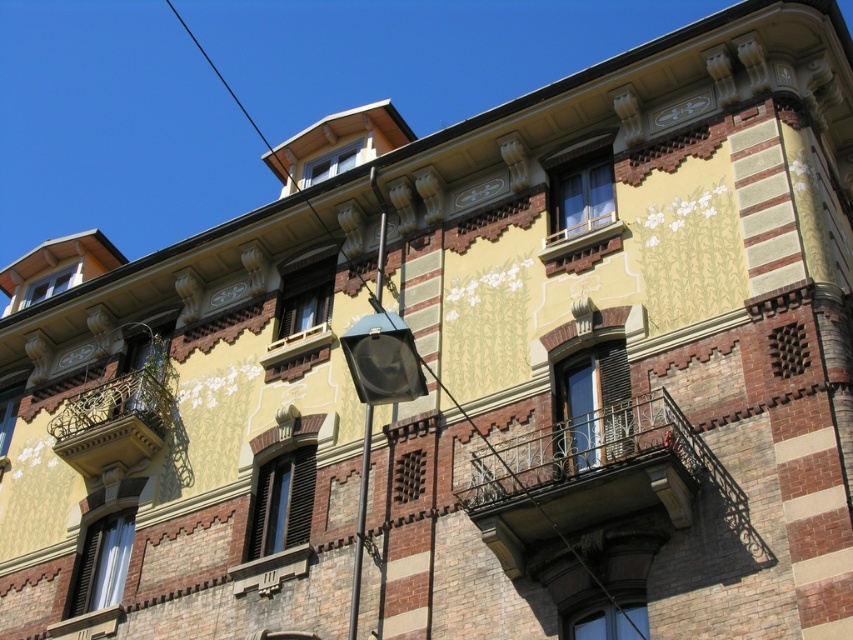
Between iron/brass balcony at center and brick balcony at upper center, which one appears on the right side from the viewer's perspective?

brick balcony at upper center

What do you see at coordinates (584, 476) in the screenshot?
I see `iron/brass balcony at center` at bounding box center [584, 476].

Find the location of `iron/brass balcony at center`. iron/brass balcony at center is located at coordinates (584, 476).

At what (x,y) coordinates should I click in order to perform the action: click on iron/brass balcony at center. Please return your answer as a coordinate pair (x, y). The height and width of the screenshot is (640, 853). Looking at the image, I should click on (584, 476).

Is iron/brass balcony at center below matte white window at lower left?

No.

Does point (579, 458) come closer to viewer compared to point (119, 568)?

Yes, point (579, 458) is closer to viewer.

Find the location of a particular element. iron/brass balcony at center is located at coordinates (584, 476).

Can you confirm if matte yellow window at upper center is wider than matte brown wooden window at center?

No, matte yellow window at upper center is not wider than matte brown wooden window at center.

Does matte yellow window at upper center appear under matte brown wooden window at center?

No, matte yellow window at upper center is not below matte brown wooden window at center.

Does point (585, 205) come farther from viewer compared to point (322, 294)?

No, it is not.

Where is `matte yellow window at upper center`? The width and height of the screenshot is (853, 640). matte yellow window at upper center is located at coordinates (582, 196).